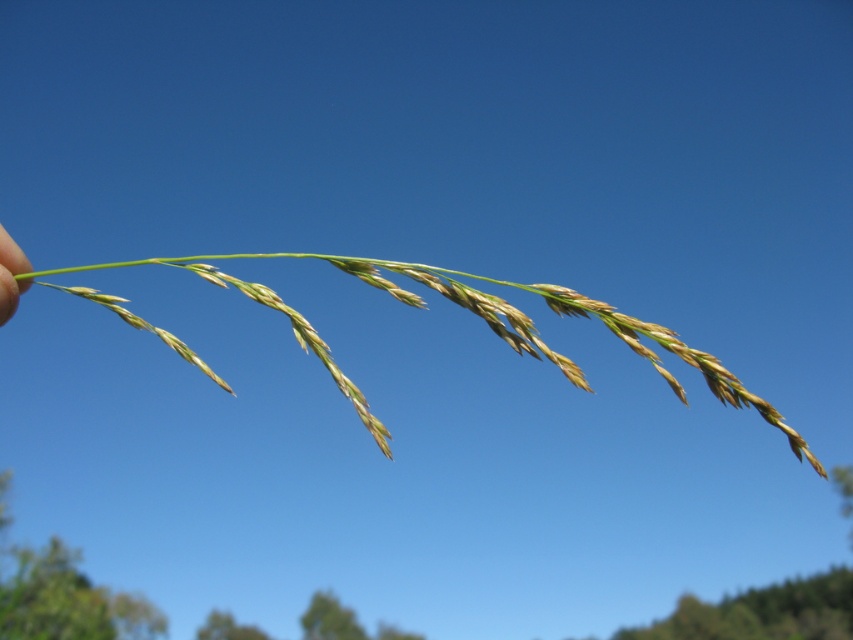
Who is more distant from viewer, (122, 312) or (12, 250)?

Point (122, 312)

What do you see at coordinates (459, 305) in the screenshot? The image size is (853, 640). I see `green grass at center` at bounding box center [459, 305].

Where is `green grass at center`? This screenshot has height=640, width=853. green grass at center is located at coordinates (459, 305).